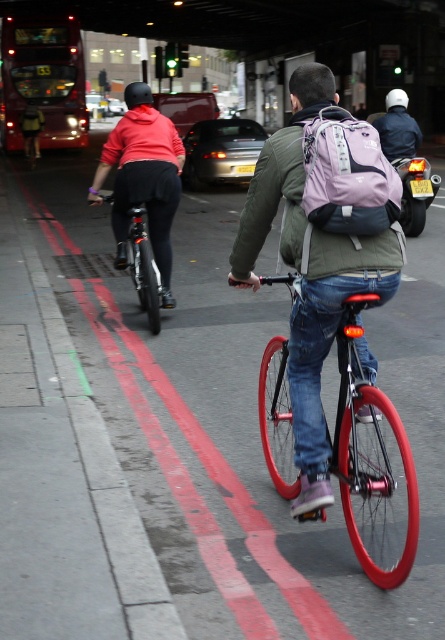
Does matte pink backpack at center appear on the right side of green matte jacket at center?

Indeed, matte pink backpack at center is positioned on the right side of green matte jacket at center.

Which is behind, point (389, 285) or point (282, 177)?

Point (282, 177)

Which is behind, point (298, 214) or point (391, 234)?

The point (298, 214) is behind.

Where is `matte pink backpack at center`? The width and height of the screenshot is (445, 640). matte pink backpack at center is located at coordinates (312, 266).

Does matte pink backpack at center have a greater width compared to shiny black bicycle at left?

Correct, the width of matte pink backpack at center exceeds that of shiny black bicycle at left.

Who is shorter, matte pink backpack at center or shiny black bicycle at left?

With less height is shiny black bicycle at left.

Is point (368, 225) positioned before point (137, 204)?

That is True.

What are the coordinates of `matte pink backpack at center` in the screenshot? It's located at (312, 266).

Is point (254, 227) more distant than point (133, 243)?

No, (254, 227) is in front of (133, 243).

Can you confirm if green matte jacket at center is bigger than shiny black bicycle at left?

Actually, green matte jacket at center might be smaller than shiny black bicycle at left.

You are a GUI agent. You are given a task and a screenshot of the screen. Output one action in this format:
    pyautogui.click(x=<x>, y=<y>)
    Task: Click on the green matte jacket at center
    The image size is (445, 640).
    Given the screenshot: What is the action you would take?
    pyautogui.click(x=271, y=204)